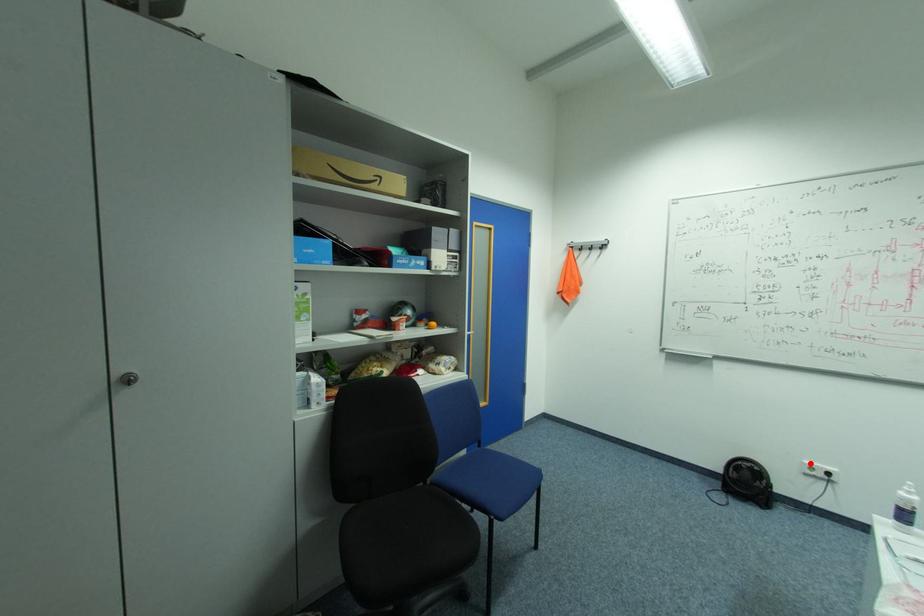
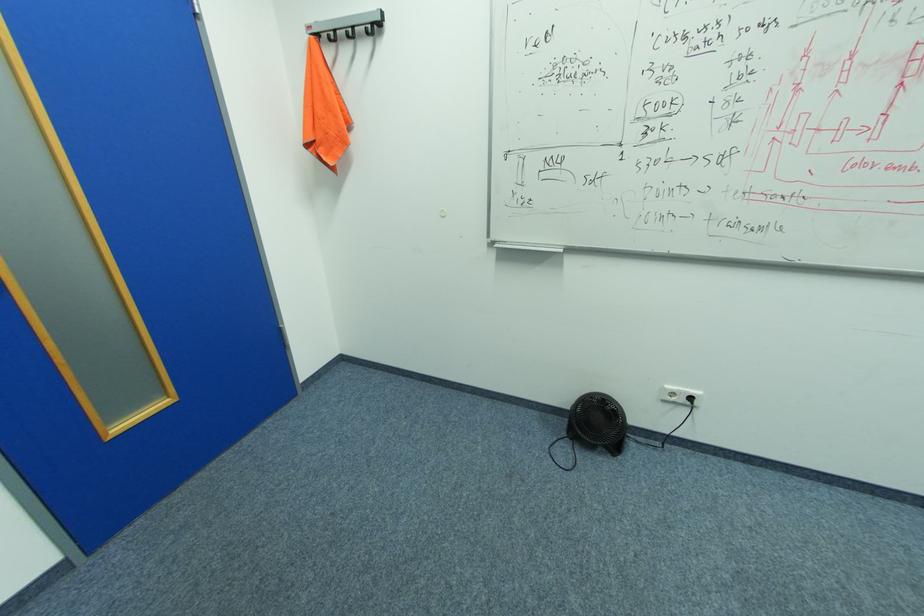
Find the pixel in the second image that matches the highlighted location in the first image.

(670, 387)